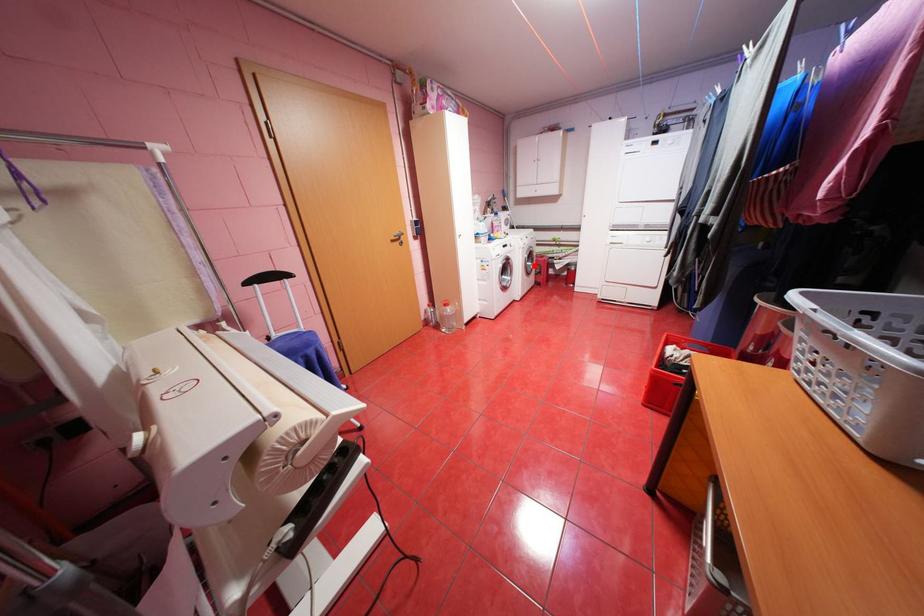
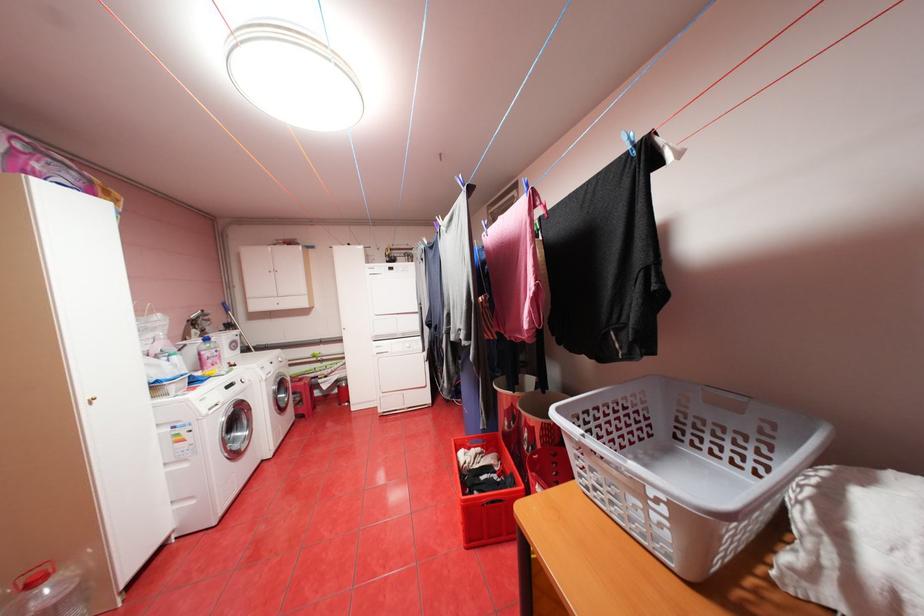
Locate, in the second image, the point that corresponds to the highlighted location in the first image.

(286, 400)